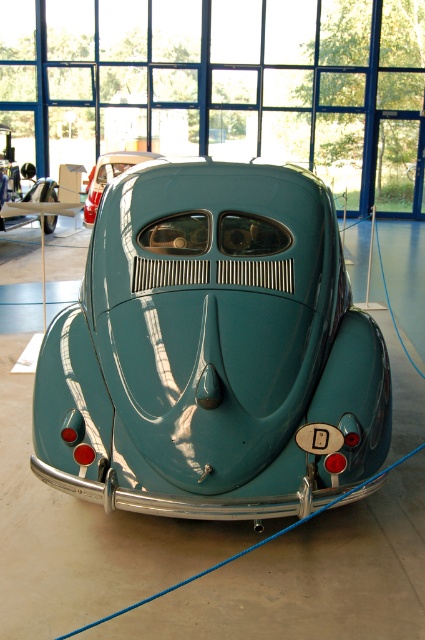
You are standing in the museum and want to take a photo of the glossy teal car at center. The museum requires visitors to stay behind the blue ropes. Given that the blue ropes are placed around the car, can you position yourself at point (212,352) to take the photo without crossing the ropes?

The glossy teal car at center is located at point (212,352). Since the blue ropes are around the car, positioning yourself exactly at that point might require crossing the ropes, so it is not advisable to do so.

You are a visitor at the museum and want to take a photo of the glossy teal car at center and the teal glossy car at center. Which one is closer to you?

The glossy teal car at center is closer to you than the teal glossy car at center.

You are standing in a museum and want to take a photo of the glossy teal car at center. If you are 1.5 meters tall, can you see the entire car without any obstruction from the floor or ceiling?

The glossy teal car at center is 3.21 meters away from viewer. Since the distance is greater than your height of 1.5 meters, you can see the entire car without obstruction from the floor or ceiling.